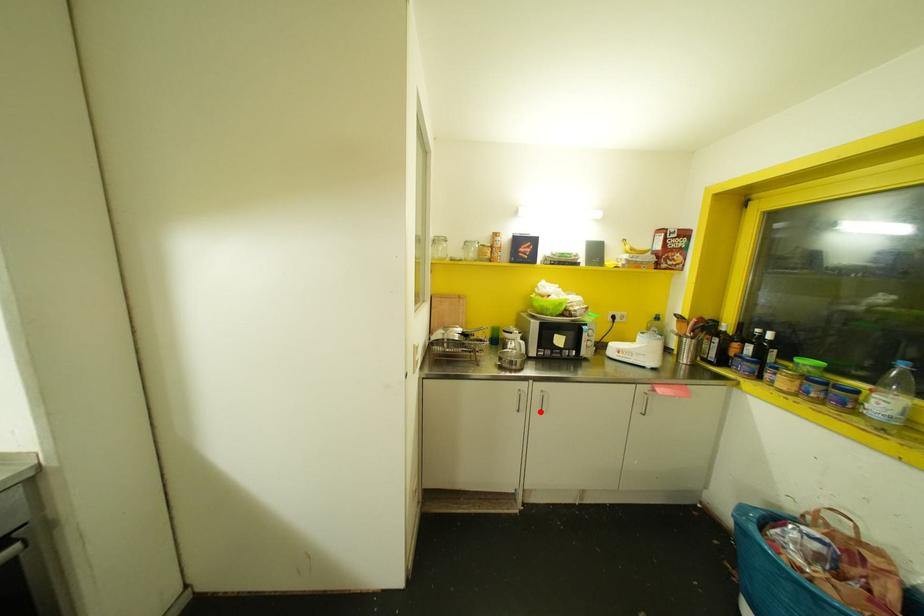
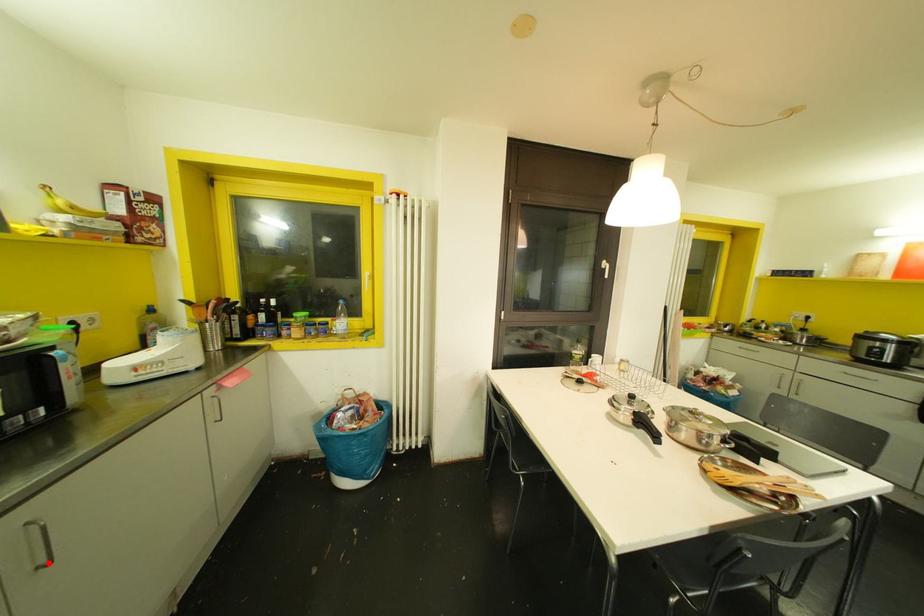
I am providing you with two images of the same scene from different viewpoints. A red point is marked on the first image and another point is marked on the second image. Is the marked point in image1 the same physical position as the marked point in image2?

Yes